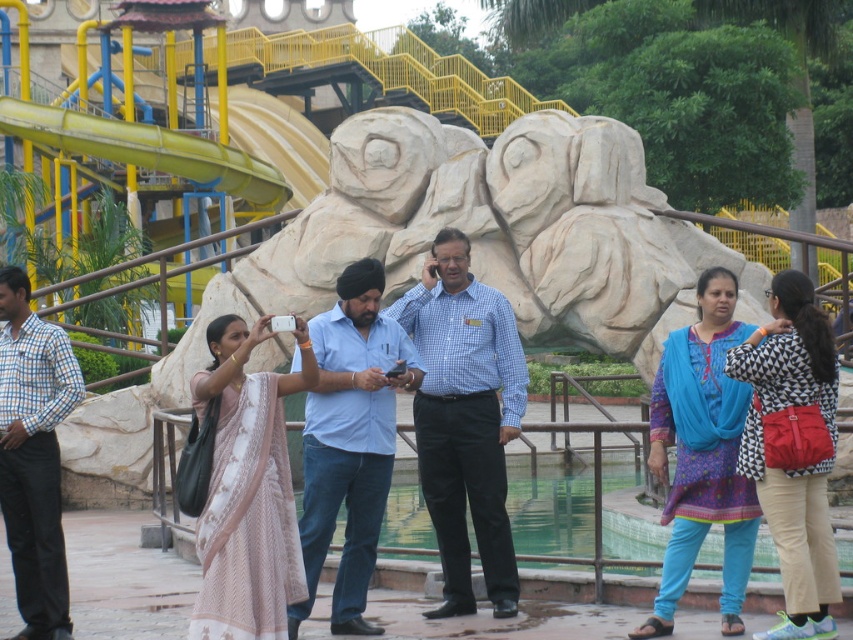
You are a photographer trying to capture a shot of the blue checkered shirt at left and the yellow rubber slide at upper left. Which object should you focus on first if you want to include both in your frame without moving the camera?

The blue checkered shirt at left is positioned on the right side of the yellow rubber slide at upper left, so you should focus on the yellow rubber slide at upper left first to ensure both are in frame.

In the scene shown: You are a photographer trying to capture both the blue cotton shirt at center and the blue checkered shirt at left in a single frame. Based on their sizes, which shirt would appear wider in the photo?

The blue cotton shirt at center would appear wider in the photo since its width is larger than the blue checkered shirt at left.

You are a photographer trying to capture the blue cotton shirt at center and the yellow rubber slide at upper left in the same frame. Based on their positions, which object is closer to the left edge of the photo?

The yellow rubber slide at upper left is closer to the left edge of the photo because the blue cotton shirt at center is to the right of it.